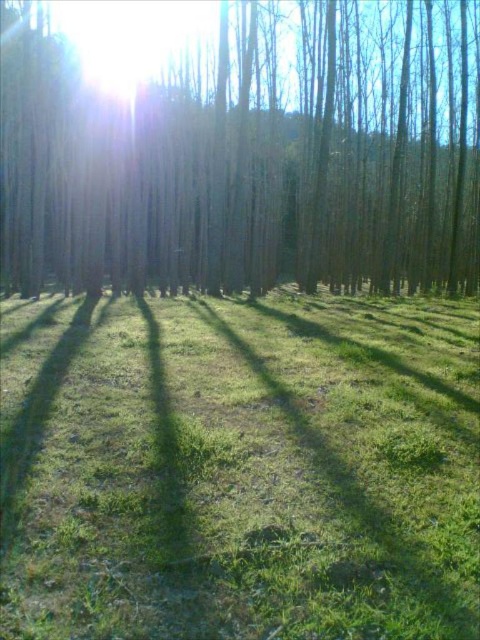
Question: Which point is closer to the camera?

Choices:
 (A) (253, 400)
 (B) (158, 259)

Answer: (A)

Question: Which of the following is the closest to the observer?

Choices:
 (A) (263, 236)
 (B) (203, 540)

Answer: (B)

Question: Does green grassy at center have a larger size compared to brown smooth tree at center?

Choices:
 (A) no
 (B) yes

Answer: (A)

Question: Does green grassy at center have a larger size compared to brown smooth tree at center?

Choices:
 (A) yes
 (B) no

Answer: (B)

Question: Does green grassy at center appear on the right side of brown smooth tree at center?

Choices:
 (A) no
 (B) yes

Answer: (B)